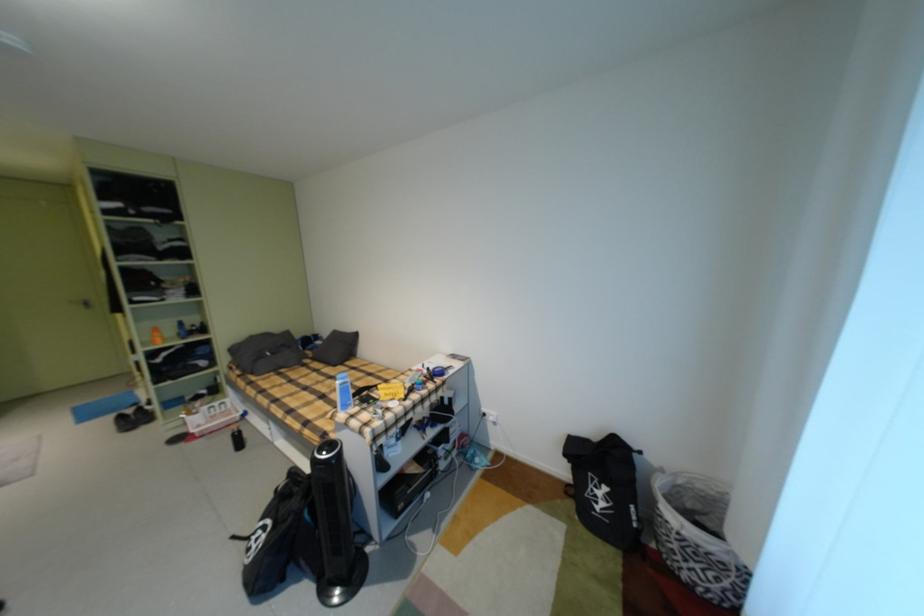
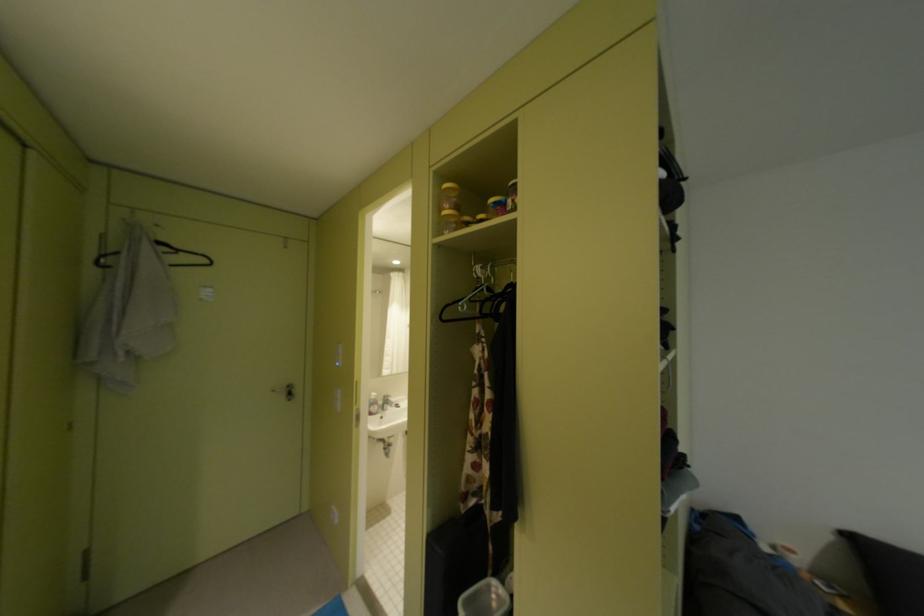
From the picture: Which direction would the cameraman need to move to produce the second image?

The cameraman moved toward left, forward.